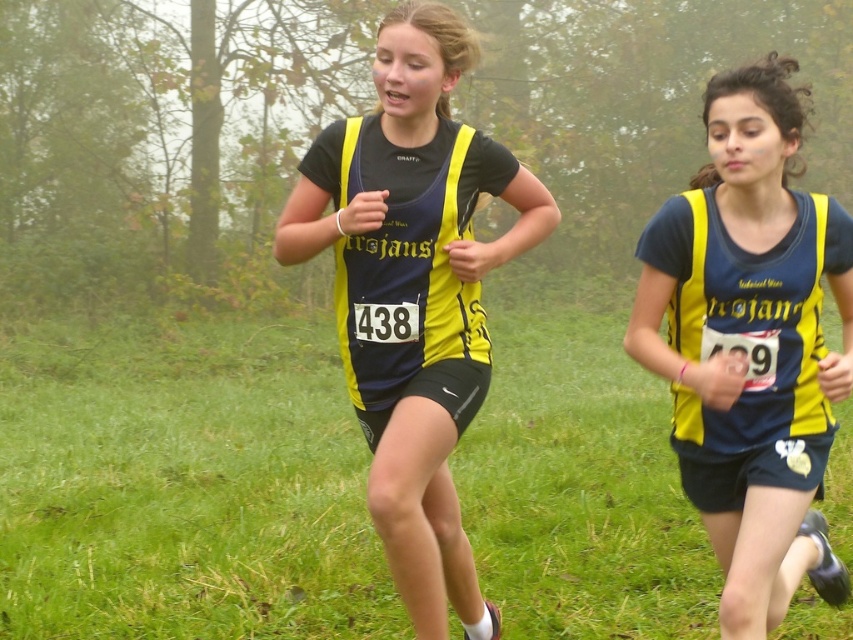
You are a race official trying to identify the runners based on their vests. You notice two runners with similar yellow vests at the center of the image. Which runner has a thinner matte yellow vest at center compared to the other yellow matte vest at center?

The matte yellow vest at center is thinner than the yellow matte vest at center, so the runner with the matte yellow vest at center has the thinner one.

You are a race official trying to locate the runner wearing the matte yellow vest at center. Based on the coordinates provided in the Objects Description, can you determine which runner is wearing it?

The matte yellow vest at center is located at point (x=750, y=344), so the runner with number 438 is wearing the matte yellow vest at center because they are in the foreground and closer to the center coordinates.